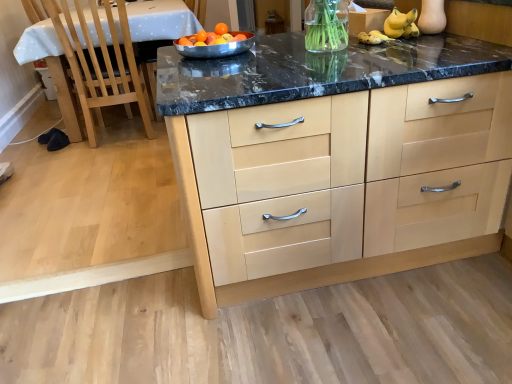
Question: Does stainless steel bowl at center have a smaller size compared to orange matte at center?

Choices:
 (A) no
 (B) yes

Answer: (A)

Question: From the image's perspective, is stainless steel bowl at center below orange matte at center?

Choices:
 (A) no
 (B) yes

Answer: (B)

Question: Considering the relative sizes of stainless steel bowl at center and orange matte at center in the image provided, is stainless steel bowl at center wider than orange matte at center?

Choices:
 (A) no
 (B) yes

Answer: (B)

Question: Can orange matte at center be found inside stainless steel bowl at center?

Choices:
 (A) yes
 (B) no

Answer: (A)

Question: Is stainless steel bowl at center positioned in front of orange matte at center?

Choices:
 (A) no
 (B) yes

Answer: (B)

Question: From a real-world perspective, is orange matte at center physically located above or below stainless steel bowl at center?

Choices:
 (A) below
 (B) above

Answer: (B)

Question: Is orange matte at center wider or thinner than stainless steel bowl at center?

Choices:
 (A) wide
 (B) thin

Answer: (B)

Question: Considering the positions of point (221, 26) and point (194, 48), is point (221, 26) closer or farther from the camera than point (194, 48)?

Choices:
 (A) farther
 (B) closer

Answer: (A)

Question: Is orange matte at center taller or shorter than stainless steel bowl at center?

Choices:
 (A) tall
 (B) short

Answer: (B)

Question: Considering the positions of stainless steel bowl at center and light wood cabinetry at center in the image, is stainless steel bowl at center bigger or smaller than light wood cabinetry at center?

Choices:
 (A) big
 (B) small

Answer: (B)

Question: Choose the correct answer: Is stainless steel bowl at center inside light wood cabinetry at center or outside it?

Choices:
 (A) inside
 (B) outside

Answer: (B)

Question: From the image's perspective, relative to light wood cabinetry at center, is stainless steel bowl at center above or below?

Choices:
 (A) below
 (B) above

Answer: (B)

Question: Would you say stainless steel bowl at center is to the left or to the right of light wood cabinetry at center in the picture?

Choices:
 (A) right
 (B) left

Answer: (B)

Question: Visually, is orange matte at center positioned to the left or to the right of white glossy table at left?

Choices:
 (A) left
 (B) right

Answer: (B)

Question: From a real-world perspective, is orange matte at center physically located above or below white glossy table at left?

Choices:
 (A) below
 (B) above

Answer: (B)